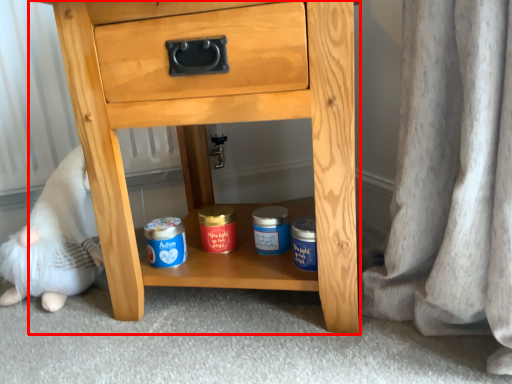
Question: From the image's perspective, what is the correct spatial positioning of chest of drawers (annotated by the red box) in reference to toy?

Choices:
 (A) below
 (B) above

Answer: (B)